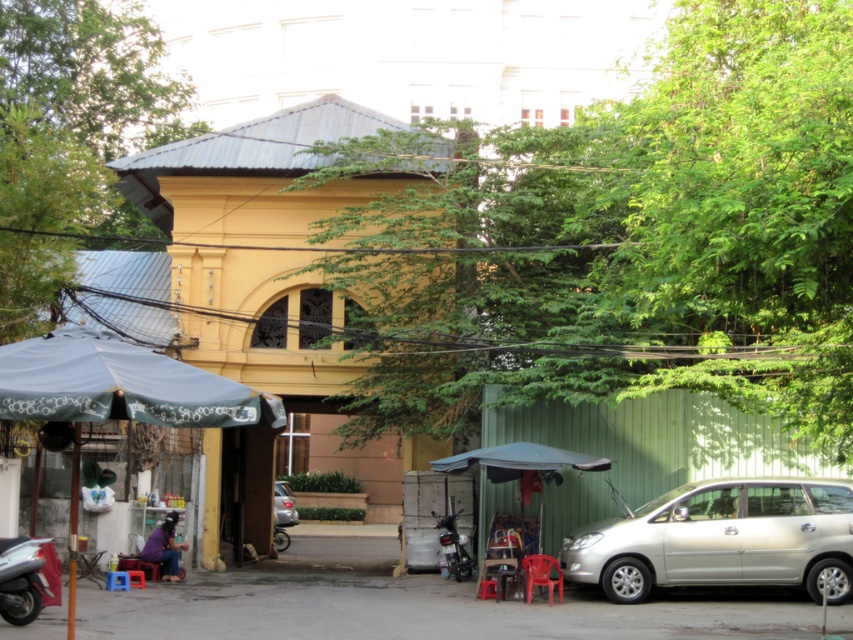
Question: Which object is farther from the camera taking this photo?

Choices:
 (A) shiny black motorcycle at center
 (B) metallic silver motorcycle at lower left
 (C) blue fabric umbrella at lower left

Answer: (A)

Question: Based on their relative distances, which object is farther from the blue fabric umbrella at lower left?

Choices:
 (A) metallic silver motorcycle at lower left
 (B) silver metallic car at lower right

Answer: (B)

Question: Can you confirm if blue fabric umbrella at lower left is positioned to the left of shiny black motorcycle at center?

Choices:
 (A) yes
 (B) no

Answer: (A)

Question: Is silver metallic car at lower right closer to camera compared to shiny black motorcycle at center?

Choices:
 (A) yes
 (B) no

Answer: (A)

Question: Which is farther from the green leafy tree at center?

Choices:
 (A) blue fabric umbrella at lower left
 (B) metallic silver motorcycle at lower left
 (C) shiny black motorcycle at center
 (D) silver metallic car at center

Answer: (D)

Question: Does green leafy tree at center appear on the left side of metallic silver motorcycle at lower left?

Choices:
 (A) yes
 (B) no

Answer: (B)